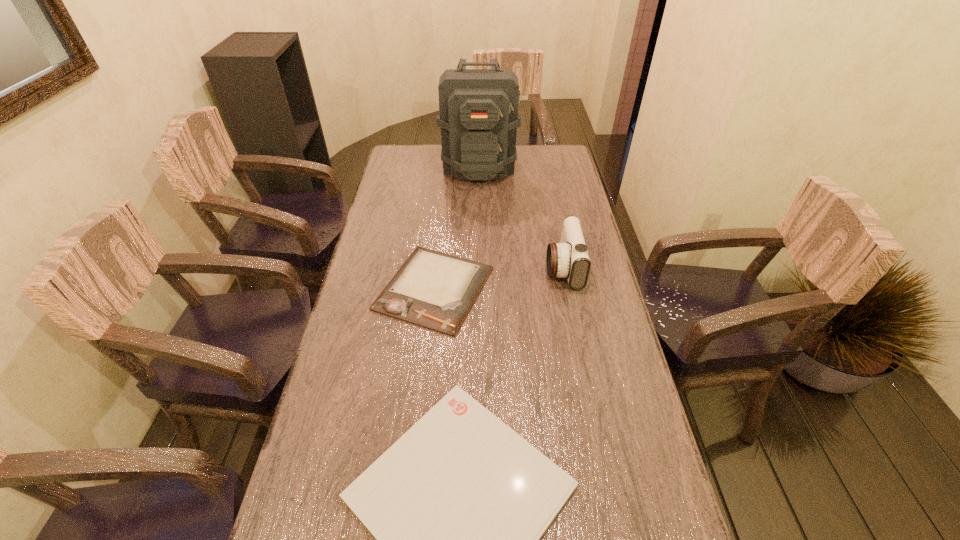
Locate an element on the screen. This screenshot has width=960, height=540. object that is at the far edge is located at coordinates (478, 116).

The image size is (960, 540). Find the location of `object present at the left edge`. object present at the left edge is located at coordinates (435, 290).

The width and height of the screenshot is (960, 540). In order to click on object at the right edge in this screenshot , I will do `click(569, 259)`.

Identify the location of vacant area at the left edge. The width and height of the screenshot is (960, 540). (312, 476).

Identify the location of vacant space at the right edge of the desktop. The height and width of the screenshot is (540, 960). (610, 535).

Locate an element on the screen. vacant position at the far left corner of the desktop is located at coordinates (406, 158).

This screenshot has height=540, width=960. I want to click on free space between the backpack and the farther clipboard, so click(457, 227).

This screenshot has width=960, height=540. Find the location of `empty space that is in between the third shortest object and the farther clipboard`. empty space that is in between the third shortest object and the farther clipboard is located at coordinates pos(498,278).

Identify the location of blank region between the backpack and the camcorder. (521, 217).

This screenshot has width=960, height=540. I want to click on vacant space in between the farther clipboard and the camcorder, so click(x=498, y=278).